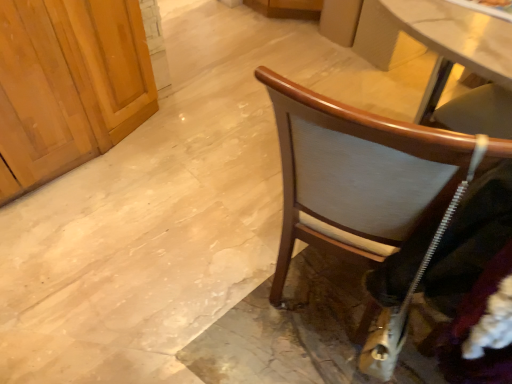
In order to click on vacant space to the left of wooden chair at right in this screenshot , I will do `click(210, 268)`.